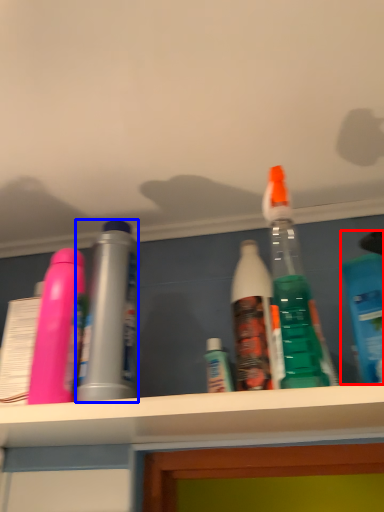
Question: Which object is further to the camera taking this photo, bottle (highlighted by a red box) or bottle (highlighted by a blue box)?

Choices:
 (A) bottle
 (B) bottle

Answer: (B)